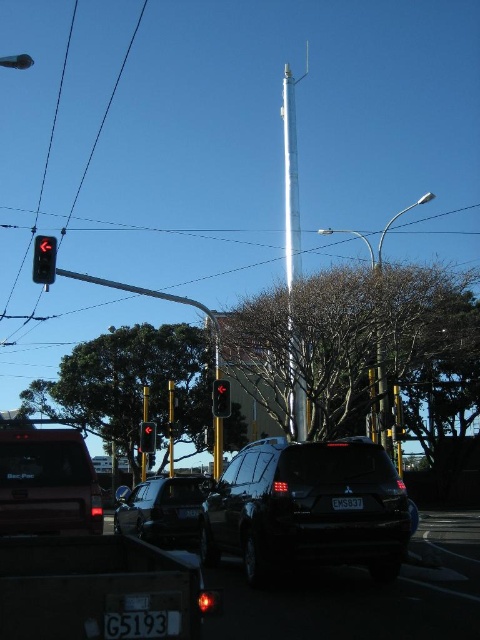
Question: Which object is positioned farthest from the dark gray metallic suv at center?

Choices:
 (A) black plastic license plate at center
 (B) metallic streetlight at center
 (C) black glossy suv at center
 (D) red glass traffic light at center

Answer: (B)

Question: Does metallic silver streetlight at upper right appear over metallic streetlight at center?

Choices:
 (A) no
 (B) yes

Answer: (B)

Question: Among these objects, which one is farthest from the camera?

Choices:
 (A) dark gray metallic suv at center
 (B) black plastic license plate at lower center

Answer: (A)

Question: Is red glass traffic light at center closer to the viewer compared to black plastic license plate at center?

Choices:
 (A) no
 (B) yes

Answer: (A)

Question: Does dark gray metallic suv at center come in front of black plastic license plate at lower center?

Choices:
 (A) yes
 (B) no

Answer: (B)

Question: Which of the following is the closest to the observer?

Choices:
 (A) (379, 248)
 (B) (32, 464)
 (C) (44, 253)
 (D) (152, 618)

Answer: (D)